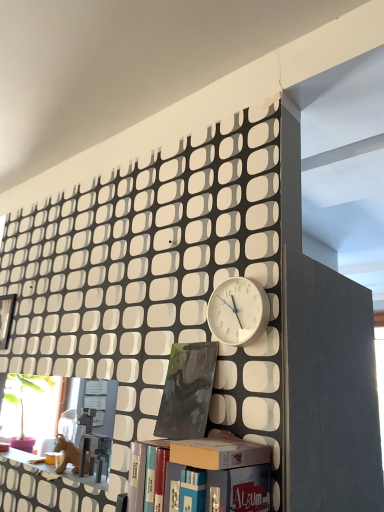
Question: Is matte cardboard box at center positioned in front of matte plastic shelf at lower left?

Choices:
 (A) no
 (B) yes

Answer: (B)

Question: From the image's perspective, is matte cardboard box at center under matte plastic shelf at lower left?

Choices:
 (A) no
 (B) yes

Answer: (A)

Question: From the image's perspective, is matte cardboard box at center on top of matte plastic shelf at lower left?

Choices:
 (A) no
 (B) yes

Answer: (B)

Question: Considering the relative sizes of matte cardboard box at center and matte plastic shelf at lower left in the image provided, is matte cardboard box at center shorter than matte plastic shelf at lower left?

Choices:
 (A) yes
 (B) no

Answer: (B)

Question: Considering the relative sizes of matte cardboard box at center and matte plastic shelf at lower left in the image provided, is matte cardboard box at center taller than matte plastic shelf at lower left?

Choices:
 (A) no
 (B) yes

Answer: (B)

Question: Choose the correct answer: Is dark green matte painting at center, the first book in the back-to-front sequence, inside matte black bookcase at lower center or outside it?

Choices:
 (A) inside
 (B) outside

Answer: (B)

Question: From the image's perspective, relative to matte black bookcase at lower center, is dark green matte painting at center, the 2th book positioned from the front, above or below?

Choices:
 (A) below
 (B) above

Answer: (A)

Question: Considering the positions of dark green matte painting at center, the 2th book positioned from the front, and matte black bookcase at lower center in the image, is dark green matte painting at center, the 2th book positioned from the front, taller or shorter than matte black bookcase at lower center?

Choices:
 (A) short
 (B) tall

Answer: (A)

Question: Is point [x=172, y=352] positioned closer to the camera than point [x=158, y=163]?

Choices:
 (A) farther
 (B) closer

Answer: (B)

Question: Considering the relative positions of matte plastic shelf at lower left and white matte clock at center in the image provided, is matte plastic shelf at lower left to the left or to the right of white matte clock at center?

Choices:
 (A) right
 (B) left

Answer: (B)

Question: Considering the positions of matte plastic shelf at lower left and white matte clock at center in the image, is matte plastic shelf at lower left wider or thinner than white matte clock at center?

Choices:
 (A) wide
 (B) thin

Answer: (A)

Question: From the image's perspective, is matte plastic shelf at lower left above or below white matte clock at center?

Choices:
 (A) above
 (B) below

Answer: (B)

Question: In terms of size, does matte plastic shelf at lower left appear bigger or smaller than white matte clock at center?

Choices:
 (A) big
 (B) small

Answer: (A)

Question: Considering their positions, is matte plastic shelf at lower left located in front of or behind matte cardboard box at center?

Choices:
 (A) front
 (B) behind

Answer: (B)

Question: Based on their positions, is matte plastic shelf at lower left located to the left or right of matte cardboard box at center?

Choices:
 (A) right
 (B) left

Answer: (B)